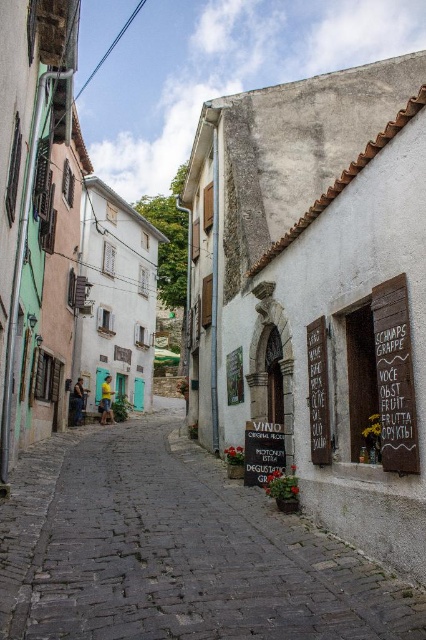
You are a tourist standing at the entrance of the narrow cobblestone street and see the black wood sign at right and the black matte sign at center. Which sign is shorter?

The black wood sign at right is shorter than the black matte sign at center.